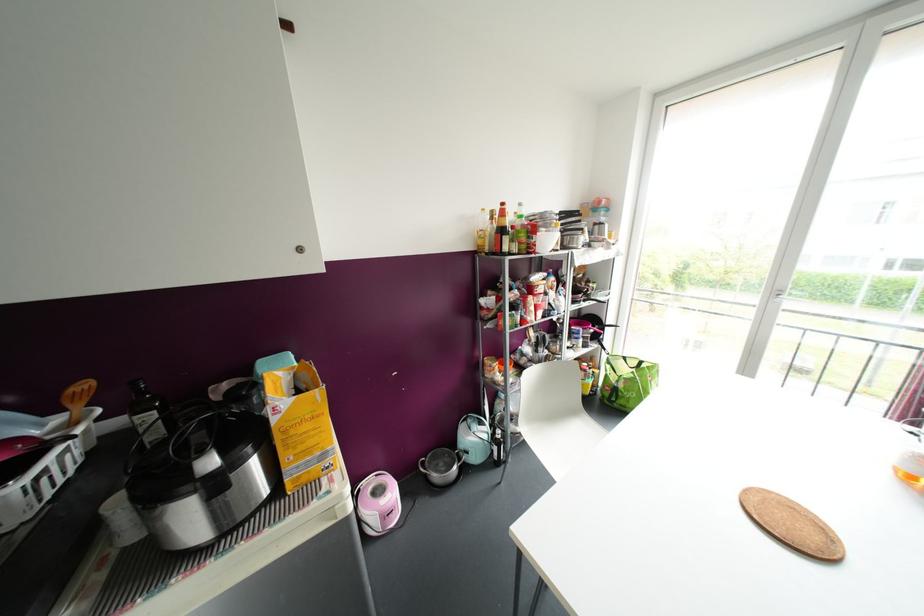
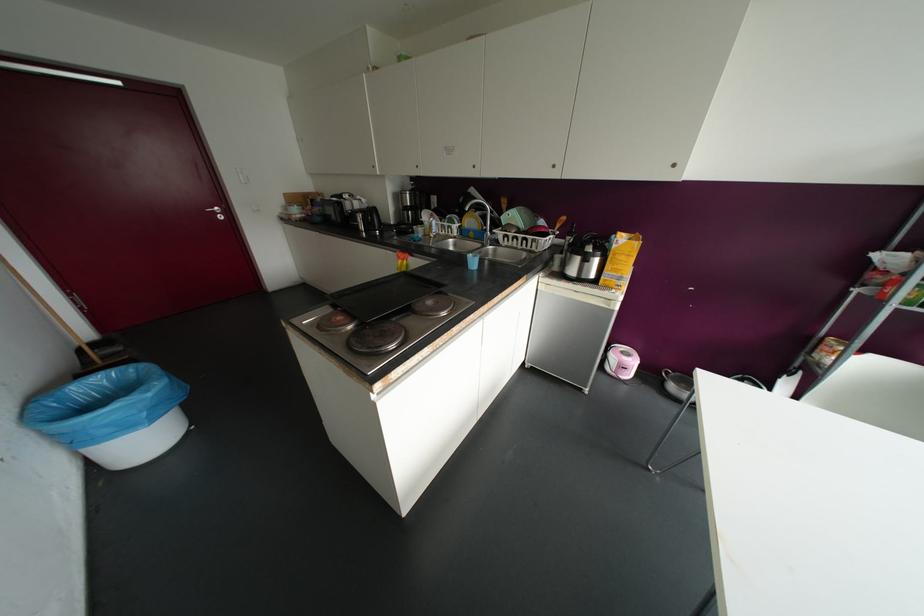
Find the pixel in the second image that matches (x=299, y=249) in the first image.

(673, 164)